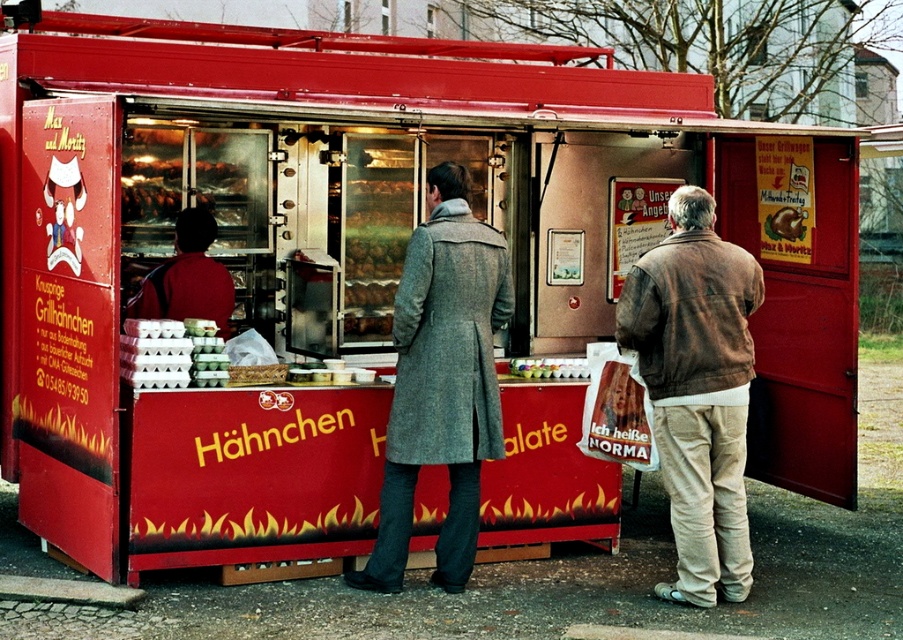
You are a customer standing in front of the food cart and you want to see both the brown leather jacket at right and the matte red jacket at center. Which jacket will appear larger in your view?

The brown leather jacket at right is much taller than the matte red jacket at center, so it will appear larger in your view.

You are a customer at the Hahnchen food cart. You see the matte plastic cups at center and the smooth chocolate bar at center. Which item is located below the other?

The matte plastic cups at center are positioned under the smooth chocolate bar at center, so the cups are below the chocolate bar.

You are a customer at the Hahnchen food cart. You see a gray wool coat at center and a smooth chocolate bar at center. Which item is bigger?

The gray wool coat at center is larger in size compared to the smooth chocolate bar at center.